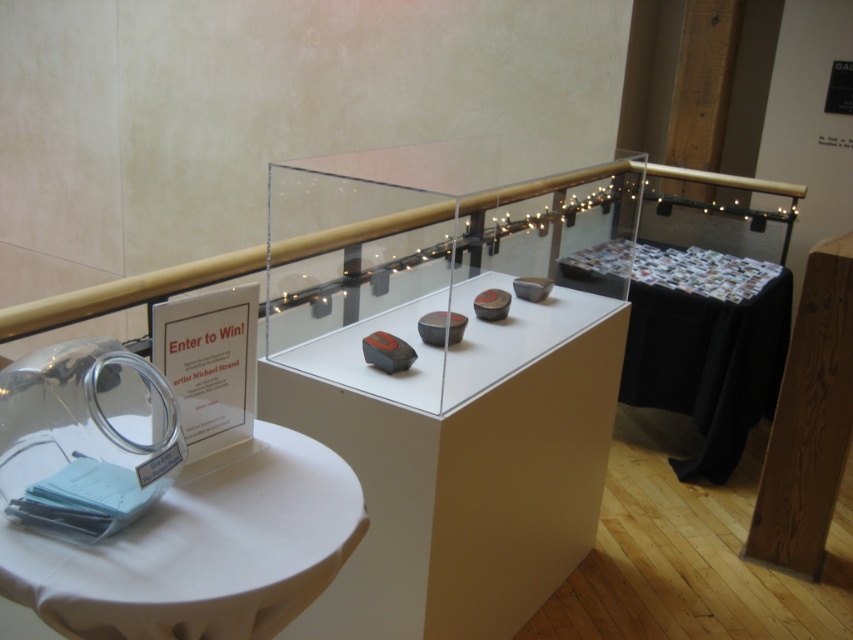
Question: Which object is closer to the camera taking this photo?

Choices:
 (A) matte gray display case at center
 (B) white cloth-covered table at lower left
 (C) black fabric table at center

Answer: (B)

Question: Which point appears closest to the camera in this image?

Choices:
 (A) (466, 476)
 (B) (138, 611)
 (C) (689, 413)

Answer: (B)

Question: Does white cloth-covered table at lower left come in front of black fabric table at center?

Choices:
 (A) yes
 (B) no

Answer: (A)

Question: Estimate the real-world distances between objects in this image. Which object is closer to the white cloth-covered table at lower left?

Choices:
 (A) matte gray display case at center
 (B) black fabric table at center

Answer: (A)

Question: Is white cloth-covered table at lower left below black fabric table at center?

Choices:
 (A) yes
 (B) no

Answer: (A)

Question: Can you confirm if matte gray display case at center is thinner than white cloth-covered table at lower left?

Choices:
 (A) yes
 (B) no

Answer: (B)